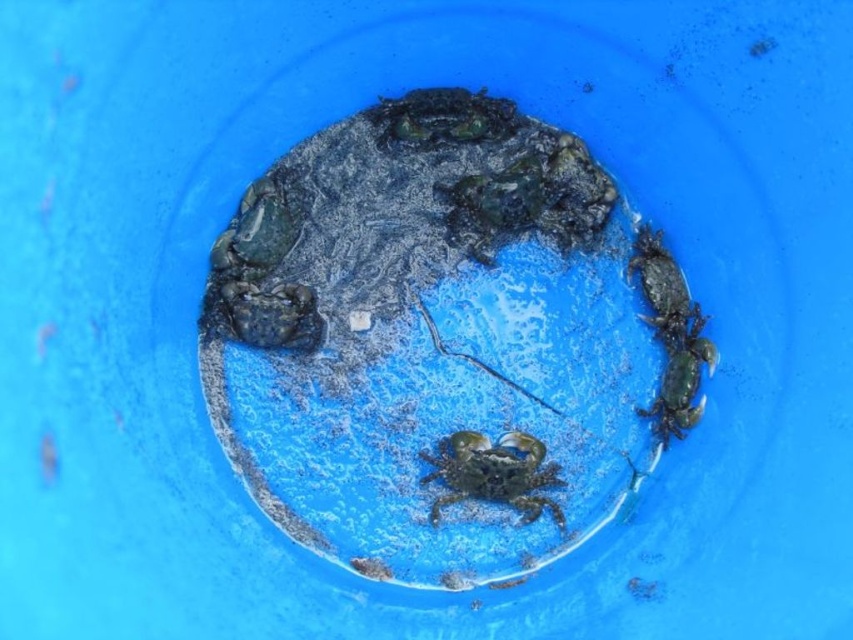
Between green matte crab at right and green matte crab at center, which one is positioned higher?

green matte crab at right is above.

Who is more distant from viewer, (664,344) or (543,458)?

Positioned behind is point (664,344).

The width and height of the screenshot is (853, 640). What are the coordinates of `green matte crab at right` in the screenshot? It's located at (671, 336).

Image resolution: width=853 pixels, height=640 pixels. I want to click on green matte crab at right, so click(x=671, y=336).